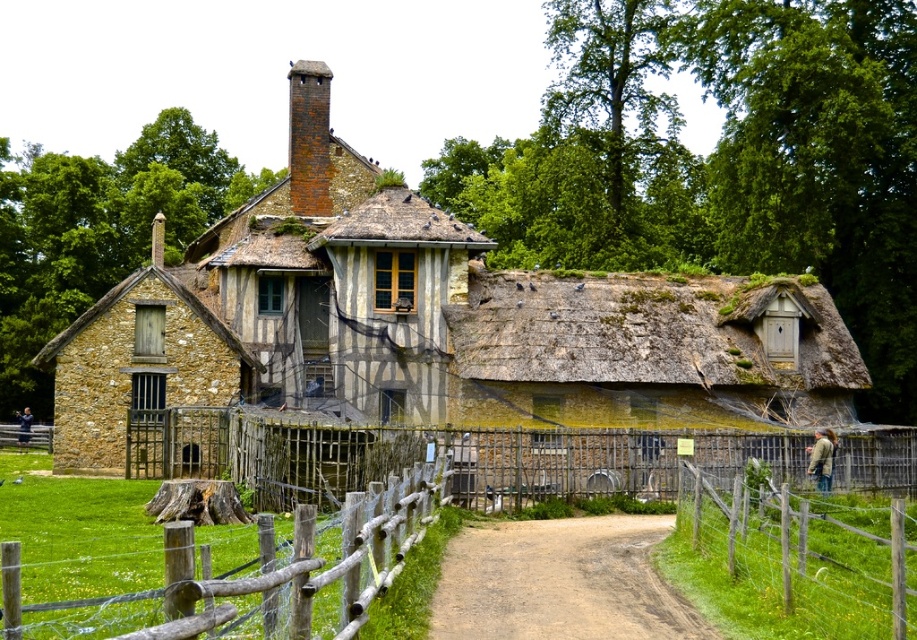
You are a traveler approaching the house along the brown dirt track at center. To your left, there is a wooden fence at right. Which direction should you turn to stay on the path towards the house?

You should continue straight along the brown dirt track at center towards the house. The wooden fence at right is to the right of the track, so turning left would take you away from the path. Stay on the center path to reach the house.